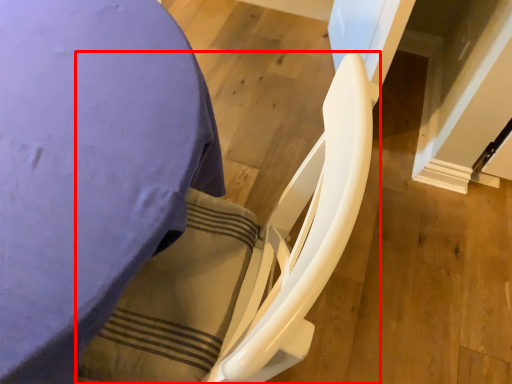
Question: From the image, what is the correct spatial relationship of rocking chair (annotated by the red box) in relation to furniture?

Choices:
 (A) right
 (B) left

Answer: (A)